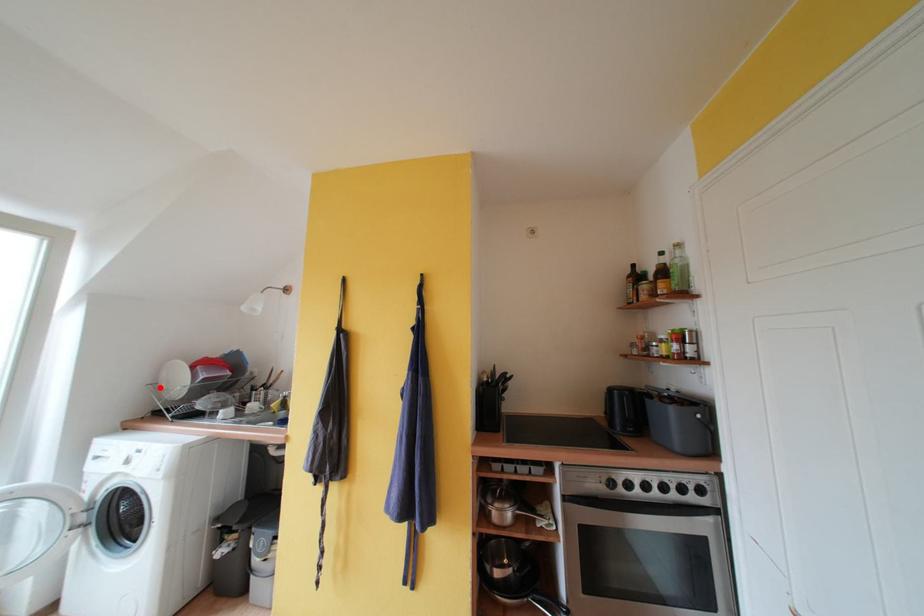
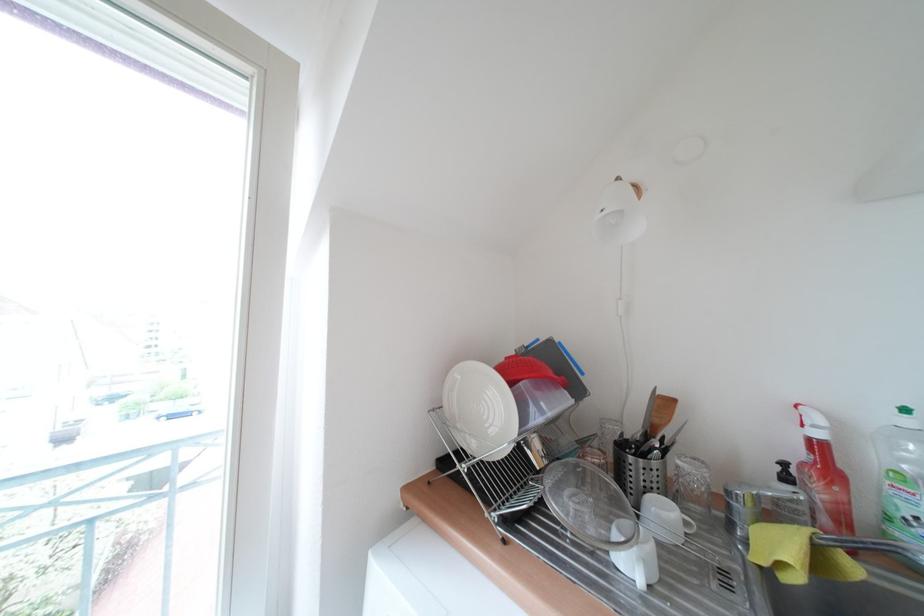
Locate, in the second image, the point that corresponds to the highlighted location in the first image.

(444, 413)